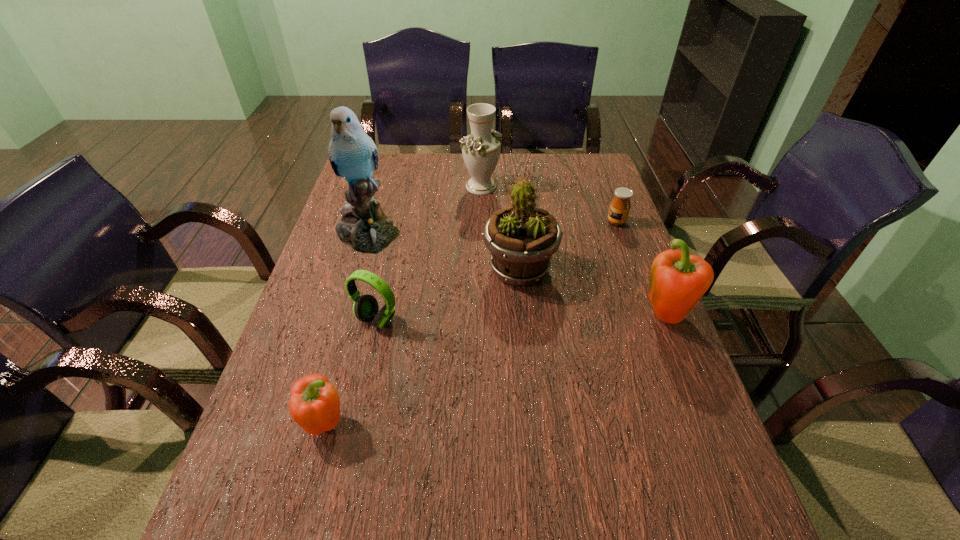
Where is `free region that satisfies the following two spatial constraints: 1. on the front-facing side of the shortest object; 2. on the face of the parakeet`? free region that satisfies the following two spatial constraints: 1. on the front-facing side of the shortest object; 2. on the face of the parakeet is located at coordinates (620, 233).

Locate an element on the screen. The image size is (960, 540). free location that satisfies the following two spatial constraints: 1. on the face of the headset; 2. on the right side of the parakeet is located at coordinates (342, 320).

Locate an element on the screen. vacant area that satisfies the following two spatial constraints: 1. on the face of the tallest object; 2. on the right side of the shorter pepper is located at coordinates (312, 423).